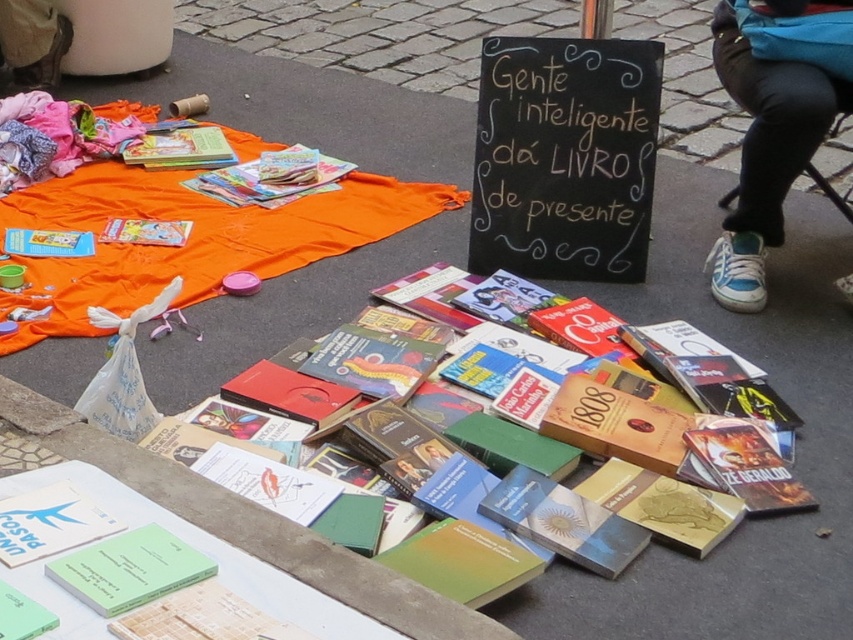
You are organizing a book sale and notice a hardcover book at center and a blue canvas shoe at lower right. Which object is positioned to the left of the other?

The hardcover book at center is to the left of the blue canvas shoe at lower right.

You are standing 5 feet away from the hardcover book at center. Can you reach it without moving your feet?

The hardcover book at center is 4.88 feet away from the viewer, so yes, you can reach it without moving your feet since it is within the 5 feet distance.

You are a delivery robot with a 50 cm wide package. You need to move from the hardcover book at center to the blue canvas shoe at lower right. Can your package fit through the space between them?

The distance between the hardcover book at center and the blue canvas shoe at lower right is 75.92 centimeters. Since the package is 50 cm wide, it can fit through the space between them as the distance is wider than the package.